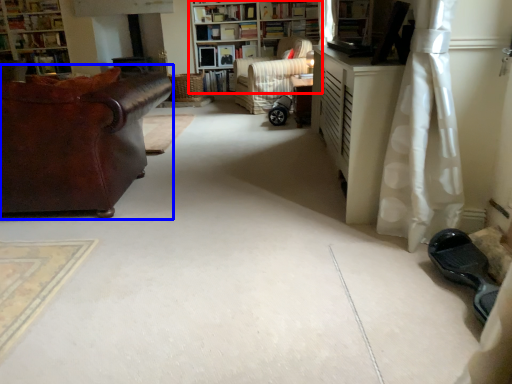
Question: Which object appears farthest to the camera in this image, bookcase (highlighted by a red box) or studio couch (highlighted by a blue box)?

Choices:
 (A) bookcase
 (B) studio couch

Answer: (A)